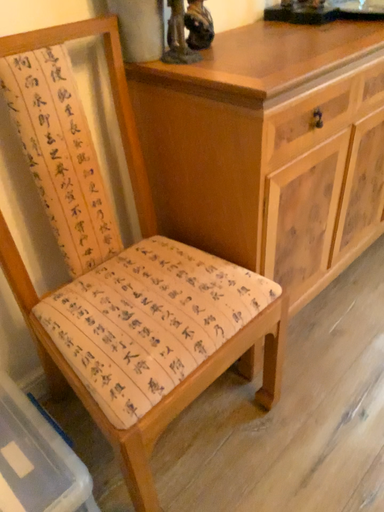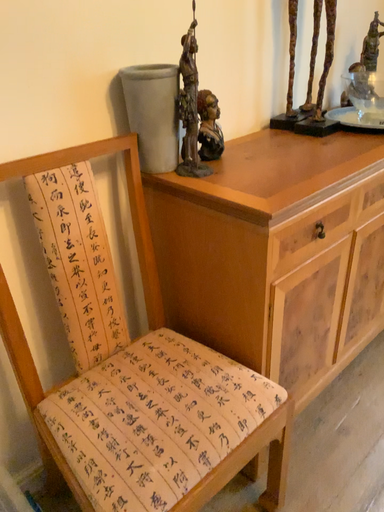
Question: Which way did the camera rotate in the video?

Choices:
 (A) rotated downward
 (B) rotated upward

Answer: (B)